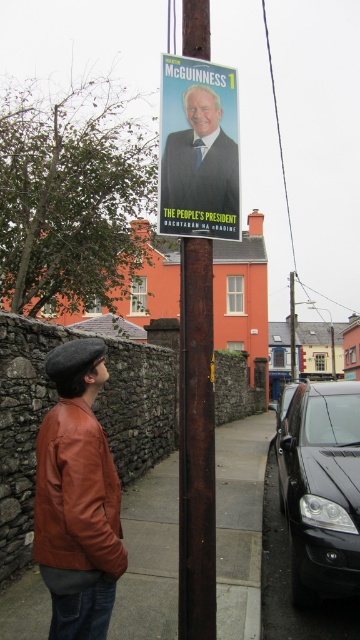
Does smooth concrete pavement at center have a greater height compared to shiny black car at center?

Incorrect, smooth concrete pavement at center's height is not larger of shiny black car at center's.

Where is `smooth concrete pavement at center`? The image size is (360, 640). smooth concrete pavement at center is located at coordinates (240, 522).

Can you confirm if black glossy car at right is positioned above rusty metal pole at center?

No, black glossy car at right is not above rusty metal pole at center.

Consider the image. Who is positioned more to the left, black glossy car at right or rusty metal pole at center?

Positioned to the left is rusty metal pole at center.

Who is more forward, (324, 442) or (208, 531)?

Point (208, 531) is in front.

The image size is (360, 640). I want to click on black glossy car at right, so click(321, 490).

Between black glossy car at right and shiny black car at center, which one is positioned lower?

shiny black car at center

Can you confirm if black glossy car at right is positioned to the left of shiny black car at center?

Correct, you'll find black glossy car at right to the left of shiny black car at center.

Is point (329, 470) behind point (285, 397)?

No, it is in front of (285, 397).

Identify the location of black glossy car at right. (321, 490).